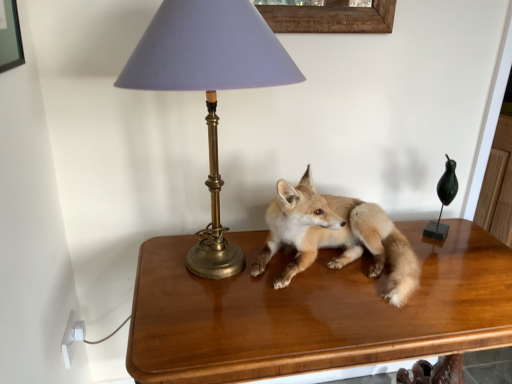
Find the location of a particular element. This screenshot has width=512, height=384. free space above shiny brown table at center (from a real-world perspective) is located at coordinates (332, 285).